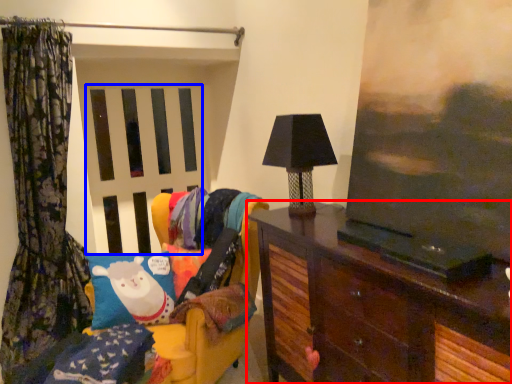
Question: Among these objects, which one is farthest to the camera, furniture (highlighted by a red box) or screen door (highlighted by a blue box)?

Choices:
 (A) furniture
 (B) screen door

Answer: (B)